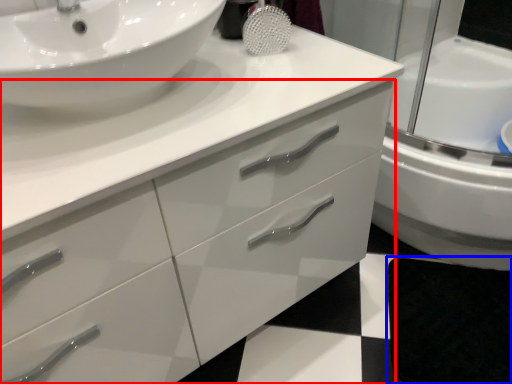
Question: Which object appears closest to the camera in this image, bathroom cabinet (highlighted by a red box) or bath mat (highlighted by a blue box)?

Choices:
 (A) bathroom cabinet
 (B) bath mat

Answer: (A)